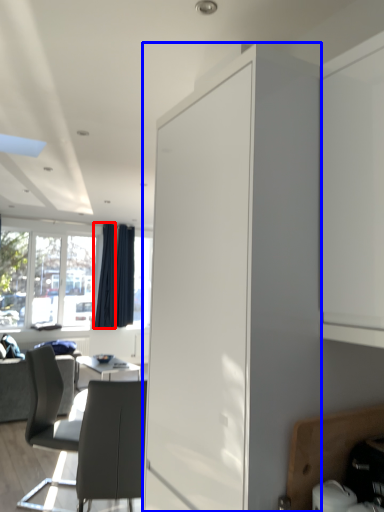
Question: Which object appears farthest to the camera in this image, curtain (highlighted by a red box) or cabinetry (highlighted by a blue box)?

Choices:
 (A) curtain
 (B) cabinetry

Answer: (A)